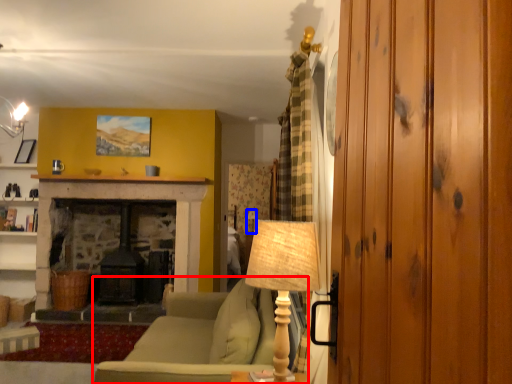
Question: Among these objects, which one is nearest to the camera, studio couch (highlighted by a red box) or table lamp (highlighted by a blue box)?

Choices:
 (A) studio couch
 (B) table lamp

Answer: (A)